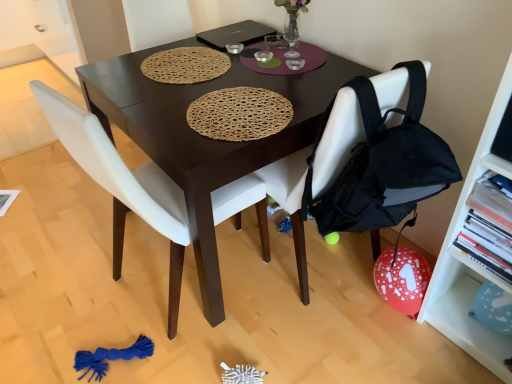
Question: Considering the relative positions of black fabric chair at center, the first chair when ordered from right to left, and black matte laptop at upper center in the image provided, is black fabric chair at center, the first chair when ordered from right to left, behind black matte laptop at upper center?

Choices:
 (A) yes
 (B) no

Answer: (B)

Question: Is black fabric chair at center, the first chair when ordered from right to left, positioned with its back to black matte laptop at upper center?

Choices:
 (A) yes
 (B) no

Answer: (B)

Question: Is the surface of black fabric chair at center, the first chair when ordered from right to left, in direct contact with black matte laptop at upper center?

Choices:
 (A) no
 (B) yes

Answer: (A)

Question: From the image's perspective, would you say black fabric chair at center, the first chair when ordered from right to left, is shown under black matte laptop at upper center?

Choices:
 (A) yes
 (B) no

Answer: (A)

Question: Is black fabric chair at center, positioned as the second chair in left-to-right order, positioned before black matte laptop at upper center?

Choices:
 (A) no
 (B) yes

Answer: (B)

Question: From their relative heights in the image, would you say dark wood table at center is taller or shorter than black matte laptop at upper center?

Choices:
 (A) tall
 (B) short

Answer: (A)

Question: From the image's perspective, is dark wood table at center positioned above or below black matte laptop at upper center?

Choices:
 (A) below
 (B) above

Answer: (A)

Question: Looking at the image, does dark wood table at center seem bigger or smaller compared to black matte laptop at upper center?

Choices:
 (A) small
 (B) big

Answer: (B)

Question: From a real-world perspective, is dark wood table at center physically located above or below black matte laptop at upper center?

Choices:
 (A) below
 (B) above

Answer: (A)

Question: In the image, is white matte chair at center, arranged as the 2th chair when viewed from the right, positioned in front of or behind white plastic shelf at right?

Choices:
 (A) front
 (B) behind

Answer: (B)

Question: Is white matte chair at center, the first chair positioned from the left, inside the boundaries of white plastic shelf at right, or outside?

Choices:
 (A) outside
 (B) inside

Answer: (A)

Question: Does point (82, 155) appear closer or farther from the camera than point (503, 350)?

Choices:
 (A) closer
 (B) farther

Answer: (A)

Question: Is white matte chair at center, arranged as the 2th chair when viewed from the right, bigger or smaller than white plastic shelf at right?

Choices:
 (A) small
 (B) big

Answer: (B)

Question: From the image's perspective, is dark wood table at center located above or below black fabric chair at center, positioned as the second chair in left-to-right order?

Choices:
 (A) above
 (B) below

Answer: (A)

Question: Does point (298, 253) appear closer or farther from the camera than point (380, 94)?

Choices:
 (A) farther
 (B) closer

Answer: (A)